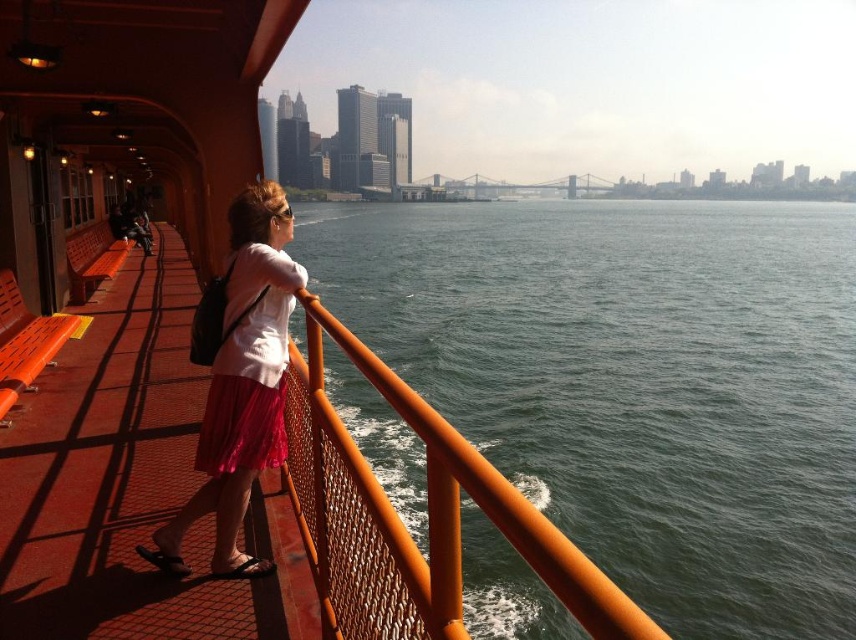
You are a photographer trying to capture the pink satin skirt at center and the orange mesh deck at center in the same frame. Which object is shorter in height?

The orange mesh deck at center has a lesser height compared to the pink satin skirt at center, so the orange mesh deck at center is shorter in height.

You are standing on the ferry deck and want to move towards the orange mesh deck at center. According to the coordinates provided, in which direction should you walk from your current position at the railing?

The orange mesh deck at center is located at coordinates point (131, 484), so you should walk towards the center of the deck from the railing position.